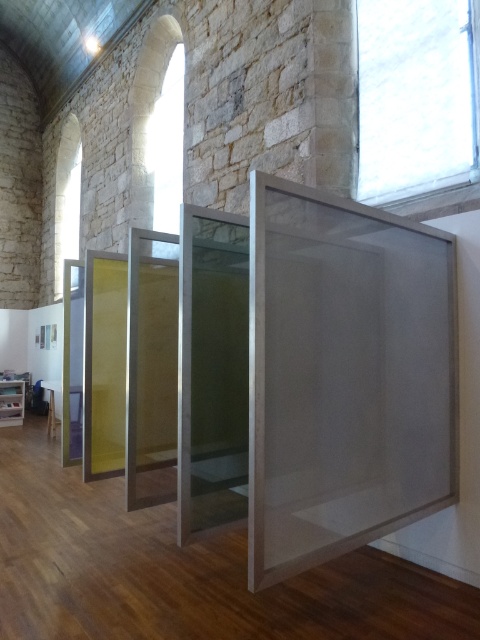
Which is more to the right, transparent mesh box at center or transparent glass box at left?

From the viewer's perspective, transparent mesh box at center appears more on the right side.

Is transparent mesh box at center thinner than transparent glass box at left?

No.

Does point (427, 488) come closer to viewer compared to point (12, 390)?

Yes, it is.

Locate an element on the screen. The image size is (480, 640). transparent mesh box at center is located at coordinates (345, 376).